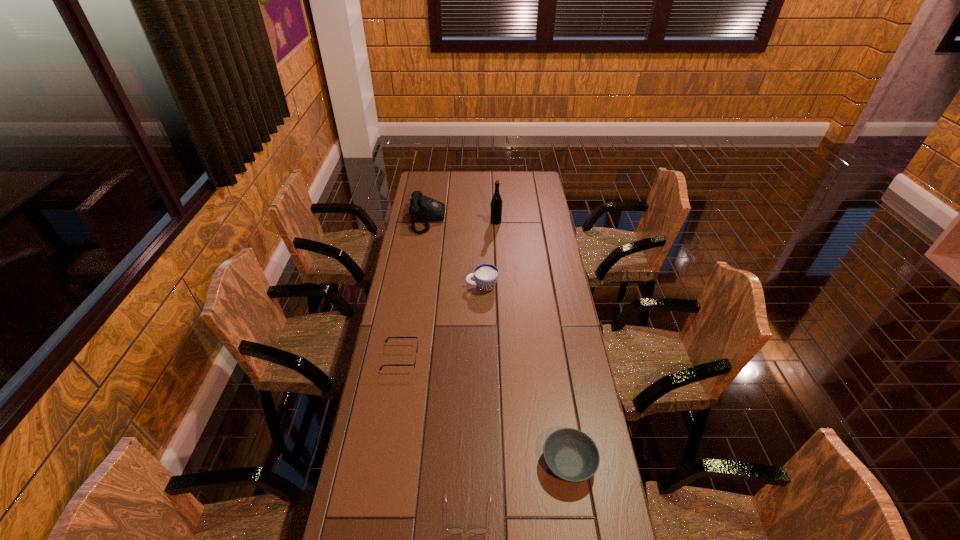
Where is `free spot at the far edge of the desktop`? The image size is (960, 540). free spot at the far edge of the desktop is located at coordinates (472, 176).

The image size is (960, 540). Find the location of `vacant space at the left edge of the desktop`. vacant space at the left edge of the desktop is located at coordinates (413, 280).

Locate an element on the screen. blank space at the right edge of the desktop is located at coordinates (556, 235).

Find the location of a particular element. This screenshot has width=960, height=540. vacant position at the far right corner of the desktop is located at coordinates (537, 187).

I want to click on free space between the second tallest object and the right spectacles, so [448, 367].

The width and height of the screenshot is (960, 540). I want to click on free space that is in between the nearer spectacles and the soup bowl, so click(518, 489).

Locate an element on the screen. This screenshot has height=540, width=960. vacant point located between the third tallest object and the fourth farthest object is located at coordinates (442, 322).

Image resolution: width=960 pixels, height=540 pixels. What are the coordinates of `free spot between the telephone and the right spectacles` in the screenshot? It's located at (448, 367).

The image size is (960, 540). In order to click on empty space that is in between the farther spectacles and the beer bottle in this screenshot , I will do `click(448, 289)`.

Image resolution: width=960 pixels, height=540 pixels. Identify the location of unoccupied position between the nearest object and the cup. (475, 400).